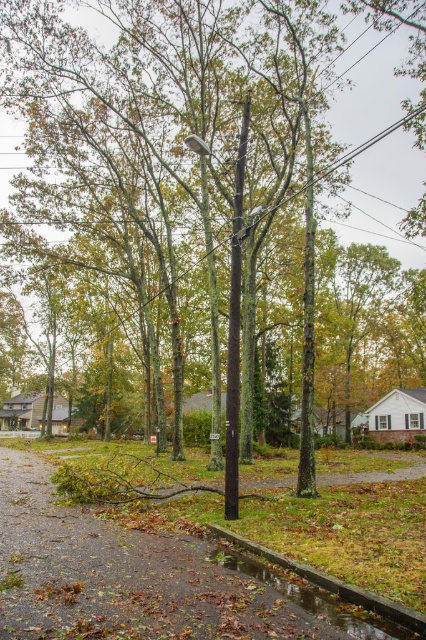
Question: Does shiny reflective puddle at lower center have a greater width compared to metallic rectangular sign at center?

Choices:
 (A) no
 (B) yes

Answer: (B)

Question: From the image, what is the correct spatial relationship of shiny reflective puddle at lower center in relation to metallic rectangular sign at center?

Choices:
 (A) below
 (B) above

Answer: (B)

Question: Is shiny reflective puddle at lower center below metallic rectangular sign at center?

Choices:
 (A) no
 (B) yes

Answer: (A)

Question: Which point is closer to the camera taking this photo?

Choices:
 (A) (241, 554)
 (B) (210, 436)

Answer: (A)